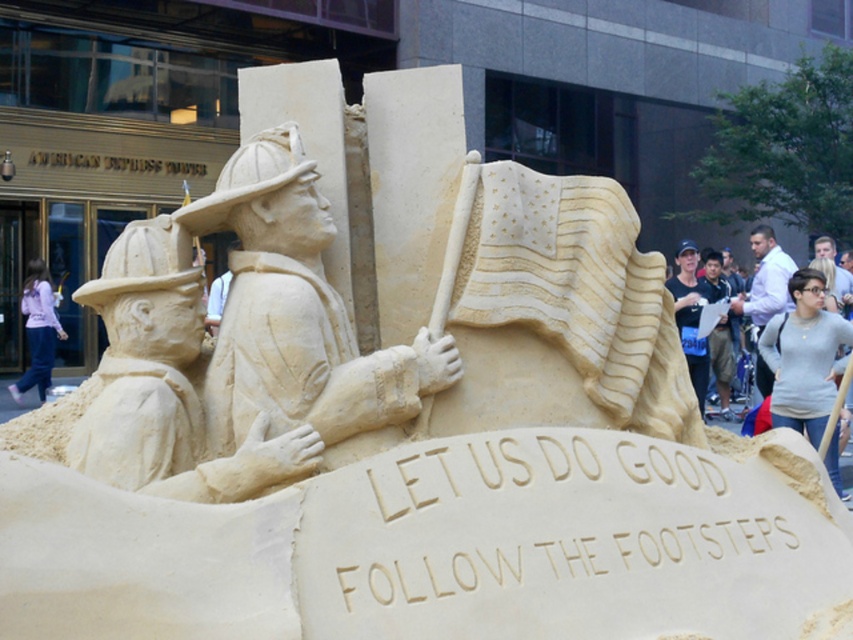
Is matte sand firefighter at left thinner than matte beige sand sculpture at center?

Yes, matte sand firefighter at left is thinner than matte beige sand sculpture at center.

Does point (190, 412) come closer to viewer compared to point (688, 244)?

That is True.

Between point (155, 273) and point (679, 252), which one is positioned in front?

Positioned in front is point (155, 273).

You are a GUI agent. You are given a task and a screenshot of the screen. Output one action in this format:
    pyautogui.click(x=<x>, y=<y>)
    Task: Click on the matte sand firefighter at left
    
    Given the screenshot: What is the action you would take?
    click(x=166, y=385)

Who is positioned more to the left, beige sand sculpture at center or white shirt at right?

beige sand sculpture at center

In the scene shown: Measure the distance between beige sand sculpture at center and camera.

beige sand sculpture at center is 12.91 meters away from camera.

Between point (233, 355) and point (781, 275), which one is positioned behind?

Positioned behind is point (781, 275).

Where is `beige sand sculpture at center`? beige sand sculpture at center is located at coordinates (299, 317).

Is beige sand sculpture at center taller than matte sand firefighter at left?

Indeed, beige sand sculpture at center has a greater height compared to matte sand firefighter at left.

Measure the distance between point (317, 413) and camera.

Point (317, 413) is 42.94 feet from camera.

Which is behind, point (399, 440) or point (294, 461)?

Positioned behind is point (399, 440).

Find the location of a particular element. The image size is (853, 640). beige sand sculpture at center is located at coordinates (299, 317).